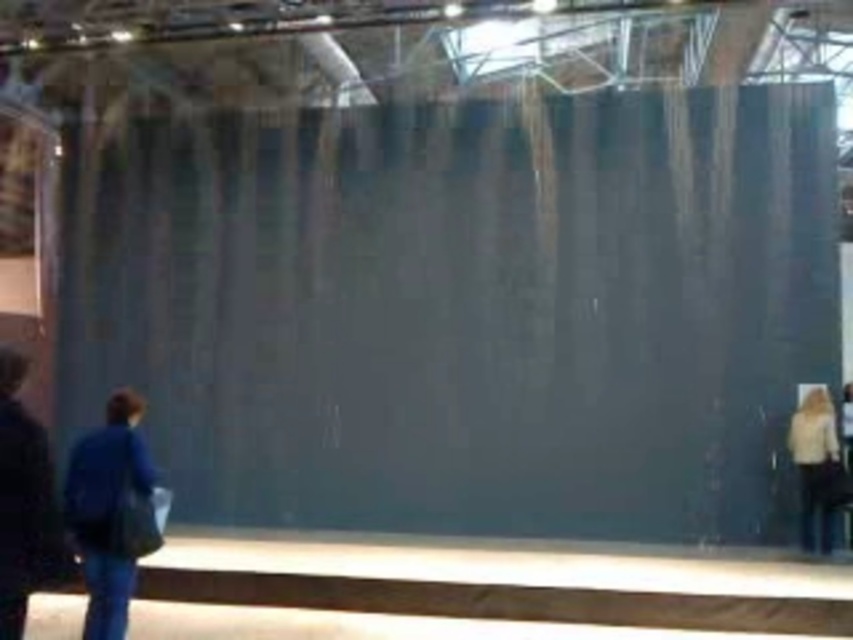
Question: Can you confirm if dark blue jacket at left is positioned above light beige sweater at lower right?

Choices:
 (A) yes
 (B) no

Answer: (A)

Question: Is the position of dark blue jacket at left more distant than that of light beige sweater at lower right?

Choices:
 (A) yes
 (B) no

Answer: (B)

Question: Which point is closer to the camera taking this photo?

Choices:
 (A) (119, 397)
 (B) (38, 458)

Answer: (B)

Question: Among these points, which one is nearest to the camera?

Choices:
 (A) (59, 570)
 (B) (137, 406)
 (C) (793, 458)

Answer: (A)

Question: Where is dark blue jacket at left located in relation to blue fabric bag at lower left in the image?

Choices:
 (A) left
 (B) right

Answer: (B)

Question: Estimate the real-world distances between objects in this image. Which object is farther from the light beige sweater at lower right?

Choices:
 (A) blue fabric bag at lower left
 (B) dark blue jacket at left

Answer: (B)